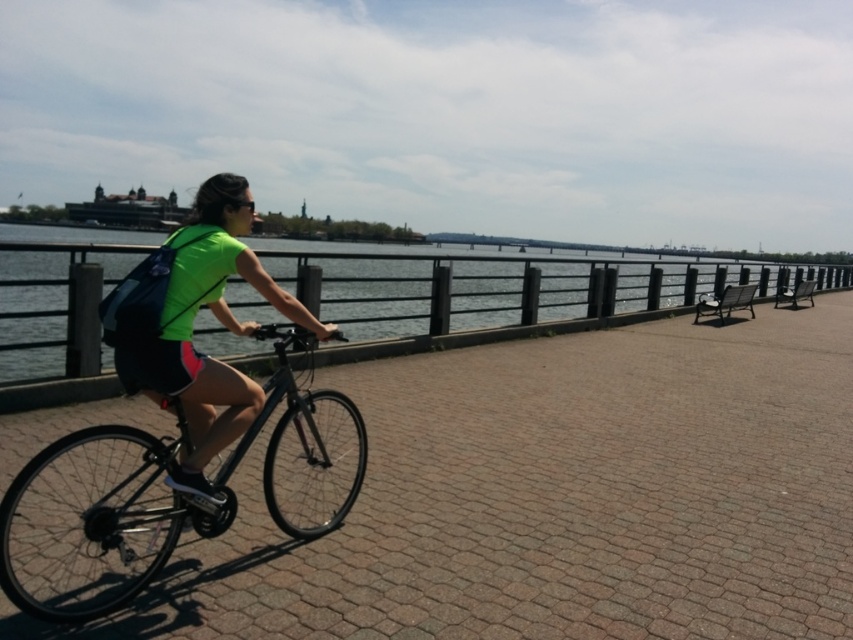
Question: Among these objects, which one is farthest from the camera?

Choices:
 (A) shiny black bicycle at center
 (B) neon green fabric at center
 (C) clear blue water at center

Answer: (C)

Question: Which point appears farthest from the camera in this image?

Choices:
 (A) (221, 397)
 (B) (96, 545)
 (C) (780, 536)

Answer: (C)

Question: Which object appears closest to the camera in this image?

Choices:
 (A) neon green fabric at center
 (B) shiny black bicycle at center
 (C) clear blue water at center

Answer: (B)

Question: Is matte black bicycle at left wider than clear blue water at center?

Choices:
 (A) yes
 (B) no

Answer: (B)

Question: Does matte black bicycle at left appear under neon green fabric at center?

Choices:
 (A) no
 (B) yes

Answer: (B)

Question: Considering the relative positions of matte black bicycle at left and clear blue water at center in the image provided, where is matte black bicycle at left located with respect to clear blue water at center?

Choices:
 (A) right
 (B) left

Answer: (A)